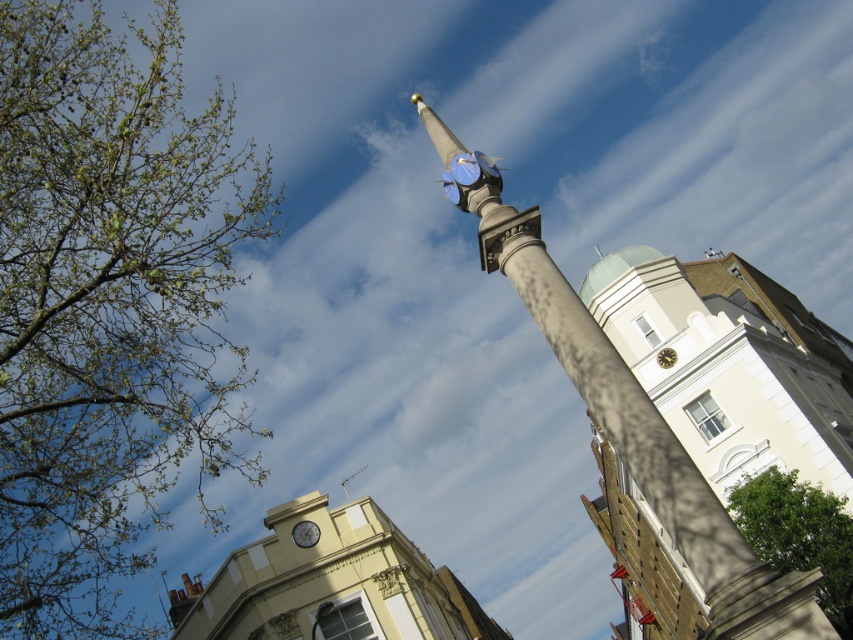
You are an architect analyzing the spatial arrangement of the scene. Which object is positioned closer to the viewer between the smooth stone pole at center and the green leafy branches at upper left?

The green leafy branches at upper left are closer to the viewer than the smooth stone pole at center, as the smooth stone pole at center is positioned behind them.